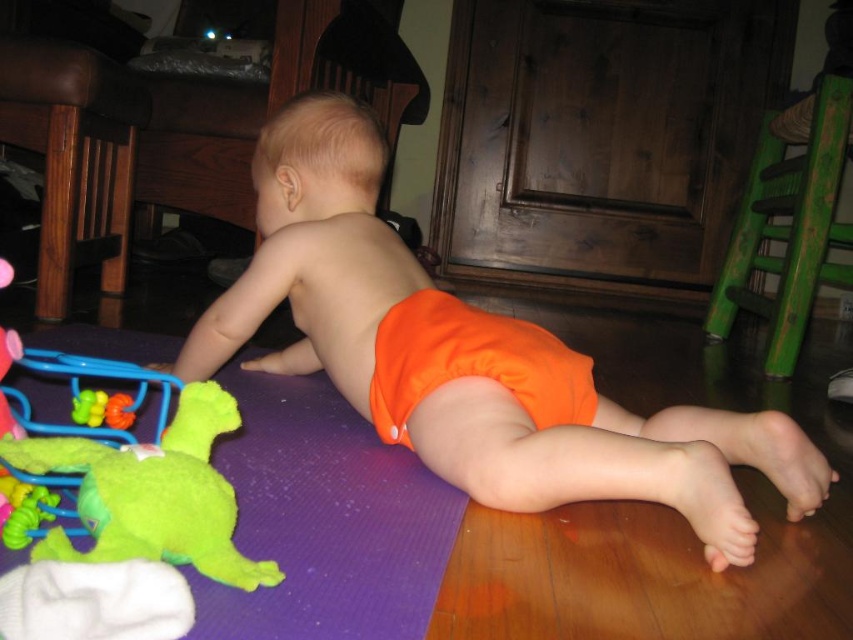
Question: Which point is closer to the camera?

Choices:
 (A) green fuzzy toy at lower left
 (B) orange fabric diaper at center

Answer: (A)

Question: In this image, where is orange fabric diaper at center located relative to green fuzzy toy at lower left?

Choices:
 (A) left
 (B) right

Answer: (B)

Question: Is orange fabric diaper at center bigger than green fuzzy toy at lower left?

Choices:
 (A) no
 (B) yes

Answer: (B)

Question: Which point is closer to the camera?

Choices:
 (A) (57, 444)
 (B) (305, 252)

Answer: (A)

Question: Is orange fabric diaper at center to the left of green fuzzy toy at lower left from the viewer's perspective?

Choices:
 (A) no
 (B) yes

Answer: (A)